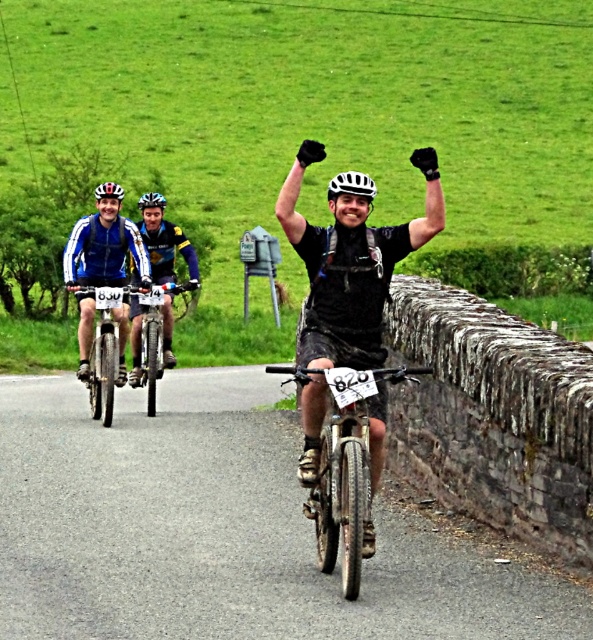
Question: Which point is closer to the camera?

Choices:
 (A) (142, 371)
 (B) (145, 198)
 (C) (365, 180)
 (D) (125, 308)

Answer: (C)

Question: Does matte black bicycle at center lie in front of white matte bicycle helmet at center?

Choices:
 (A) yes
 (B) no

Answer: (B)

Question: Which is nearer to the black matte bicycle helmet at upper center?

Choices:
 (A) matte black bicycle at center
 (B) white matte bicycle helmet at center
 (C) blue fabric jacket at left
 (D) matte black bicycle at left

Answer: (D)

Question: Is matte black helmet at upper center behind black matte bicycle helmet at upper center?

Choices:
 (A) yes
 (B) no

Answer: (B)

Question: Is metallic silver bicycle at center further to the viewer compared to matte black bicycle at left?

Choices:
 (A) yes
 (B) no

Answer: (B)

Question: Estimate the real-world distances between objects in this image. Which object is farther from the blue fabric jacket at left?

Choices:
 (A) white matte bicycle helmet at center
 (B) matte black bicycle at center
 (C) matte black bicycle at left

Answer: (A)